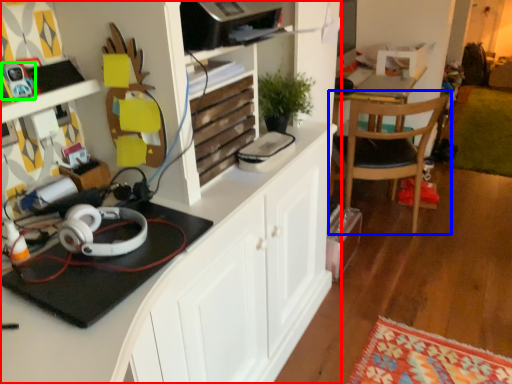
Question: Considering the real-world distances, which object is closest to cabinetry (highlighted by a red box)? chair (highlighted by a blue box) or toy (highlighted by a green box).

Choices:
 (A) chair
 (B) toy

Answer: (B)